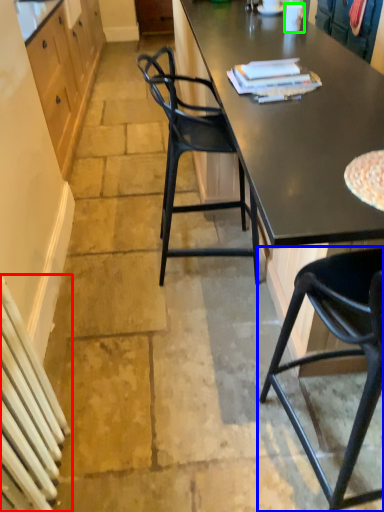
Question: Based on their relative distances, which object is nearer to radiator (highlighted by a red box)? Choose from chair (highlighted by a blue box) and coffee cup (highlighted by a green box).

Choices:
 (A) chair
 (B) coffee cup

Answer: (A)